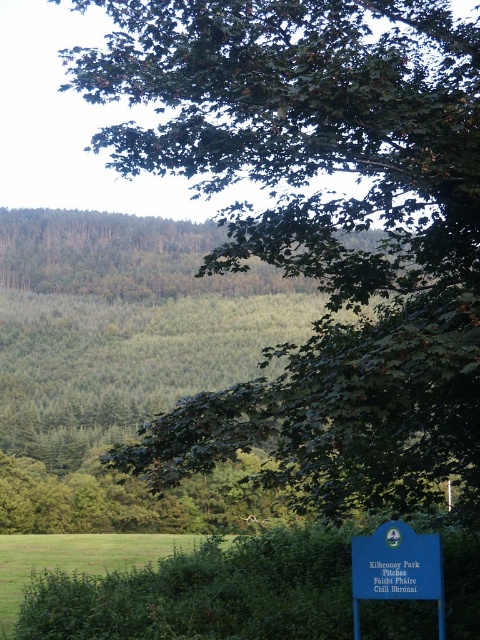
Question: Which of these objects is positioned farthest from the blue plastic sign at lower right?

Choices:
 (A) green grass at lower left
 (B) green leafy hedge at lower center

Answer: (A)

Question: Is green leafy hedge at lower center thinner than blue plastic sign at lower right?

Choices:
 (A) no
 (B) yes

Answer: (A)

Question: Which is farther from the blue plastic sign at lower right?

Choices:
 (A) green grass at lower left
 (B) green leafy hedge at lower center

Answer: (A)

Question: Considering the relative positions of green grass at lower left and blue plastic sign at lower right in the image provided, where is green grass at lower left located with respect to blue plastic sign at lower right?

Choices:
 (A) right
 (B) left

Answer: (B)

Question: Observing the image, what is the correct spatial positioning of green leafy hedge at lower center in reference to green grass at lower left?

Choices:
 (A) right
 (B) left

Answer: (A)

Question: Which of the following is the closest to the observer?

Choices:
 (A) (384, 573)
 (B) (304, 564)

Answer: (A)